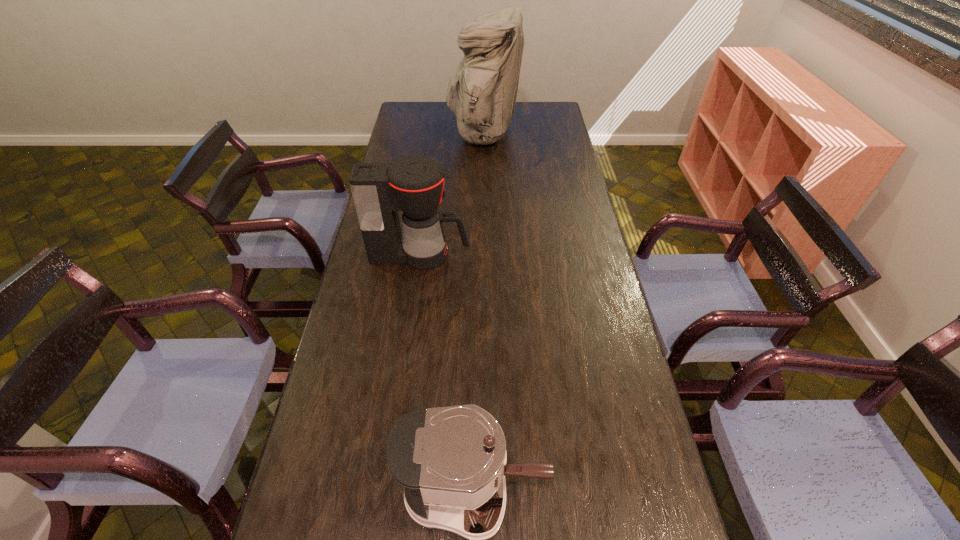
This screenshot has width=960, height=540. In order to click on the closest object relative to the nearest object in this screenshot , I will do (414, 185).